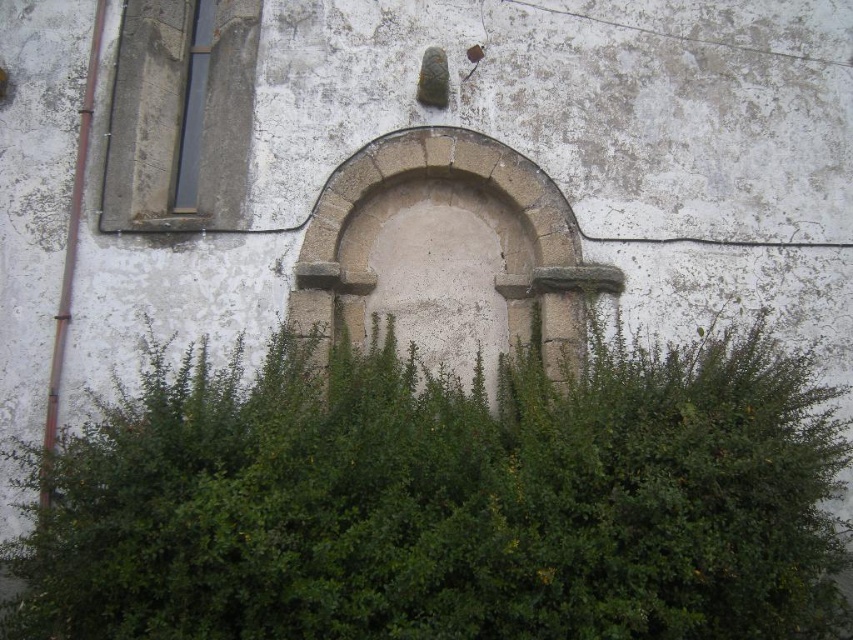
Question: Does stone archway at center appear over matte concrete window at upper left?

Choices:
 (A) no
 (B) yes

Answer: (A)

Question: Does green leafy hedge at center appear on the right side of stone archway at center?

Choices:
 (A) yes
 (B) no

Answer: (B)

Question: Which point is closer to the camera?

Choices:
 (A) smooth glass window at upper left
 (B) stone archway at center
 (C) green leafy hedge at center

Answer: (C)

Question: Is the position of matte concrete window at upper left less distant than that of smooth glass window at upper left?

Choices:
 (A) no
 (B) yes

Answer: (B)

Question: Which object appears farthest from the camera in this image?

Choices:
 (A) matte concrete window at upper left
 (B) green leafy hedge at center

Answer: (A)

Question: Which object is the closest to the stone archway at center?

Choices:
 (A) matte concrete window at upper left
 (B) smooth glass window at upper left
 (C) green leafy hedge at center

Answer: (C)